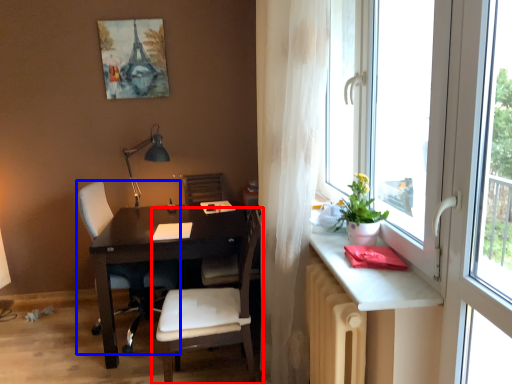
Question: Which of the following is the closest to the observer, chair (highlighted by a red box) or chair (highlighted by a blue box)?

Choices:
 (A) chair
 (B) chair

Answer: (A)